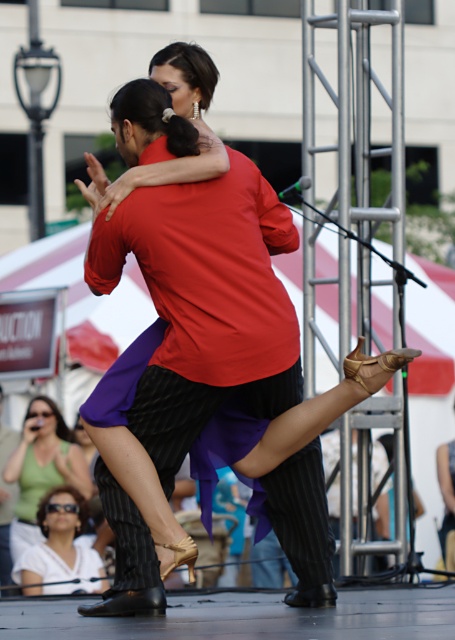
You are a photographer at the event and need to capture both the matte red shirt at center and the white matte sunglasses at lower left in your frame. Which object should you focus on first to ensure both are in the frame?

The matte red shirt at center is shorter than the white matte sunglasses at lower left. Therefore, focus on the white matte sunglasses at lower left first to ensure both fit within the frame.

From the picture: You are a photographer standing in front of the stage. You want to capture the exact location of the matte red shirt at center. What are the coordinates where you should focus your camera?

The coordinates for the matte red shirt at center are at point (187,358).